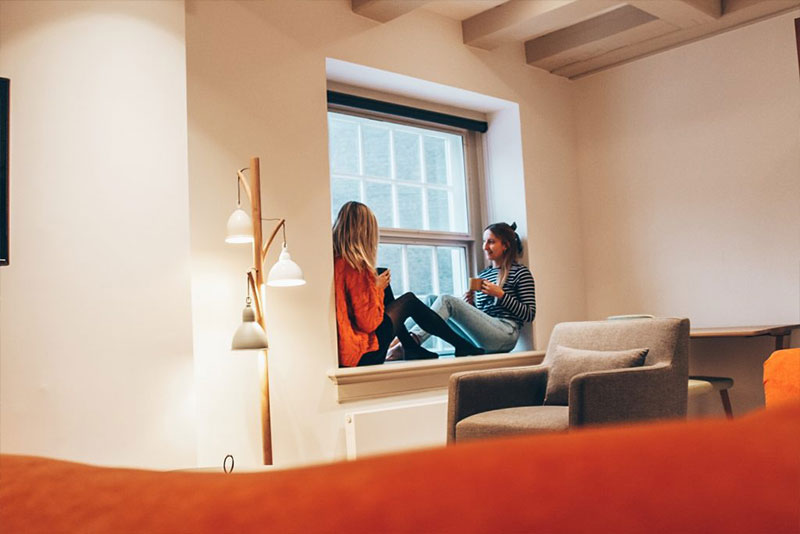
This screenshot has height=534, width=800. I want to click on grey pillow, so click(568, 357).